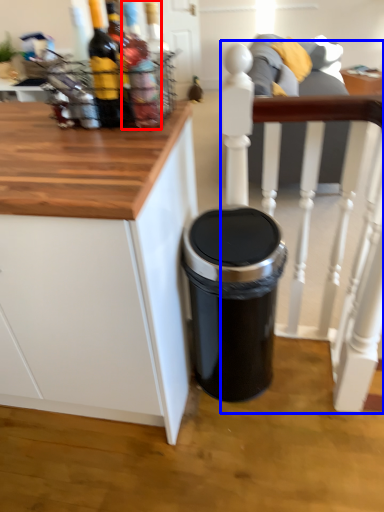
Question: Which object appears farthest to the camera in this image, bottle (highlighted by a red box) or chair (highlighted by a blue box)?

Choices:
 (A) bottle
 (B) chair

Answer: (B)